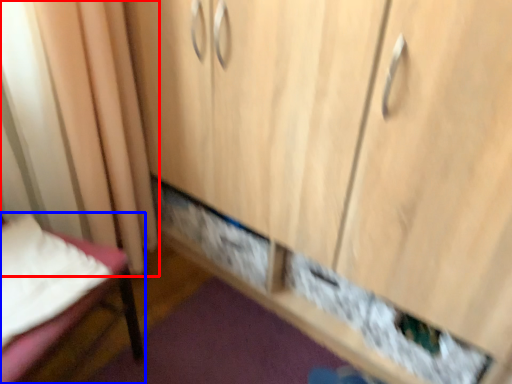
Question: Which object appears closest to the camera in this image, curtain (highlighted by a red box) or furniture (highlighted by a blue box)?

Choices:
 (A) curtain
 (B) furniture

Answer: (B)